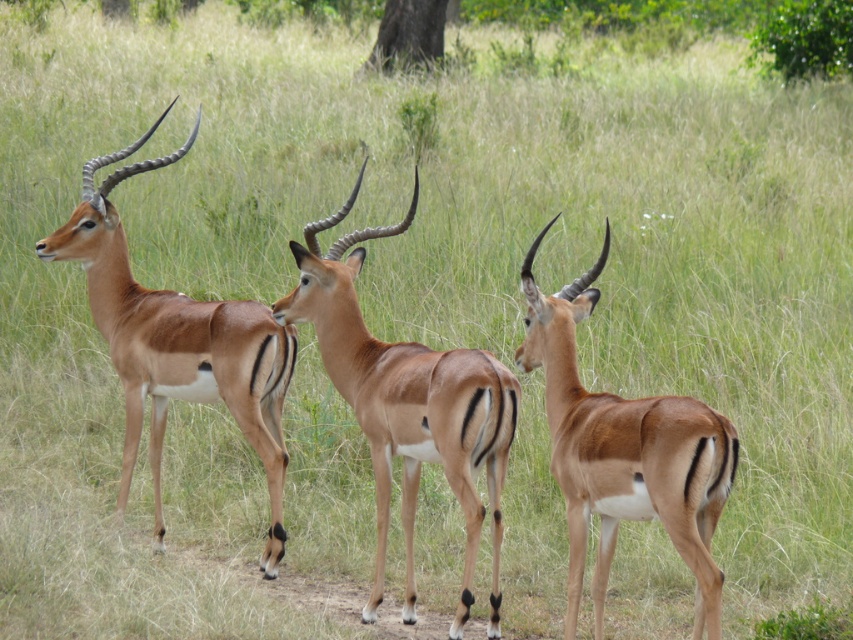
You are a wildlife photographer aiming to capture a group photo of the brown glossy antelope at center and the brown glossy antelope at left. Since you want to ensure both animals are in focus, you need to know their sizes. Which antelope is bigger?

The brown glossy antelope at center is larger than the brown glossy antelope at left, so you should adjust your camera settings to accommodate the size difference for better focus.